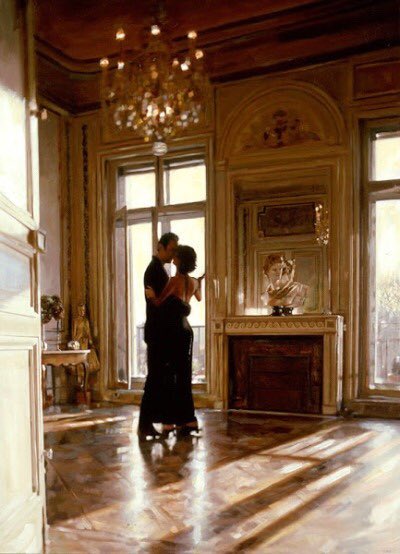
Identify the location of chandelier. The height and width of the screenshot is (554, 400). (162, 98).